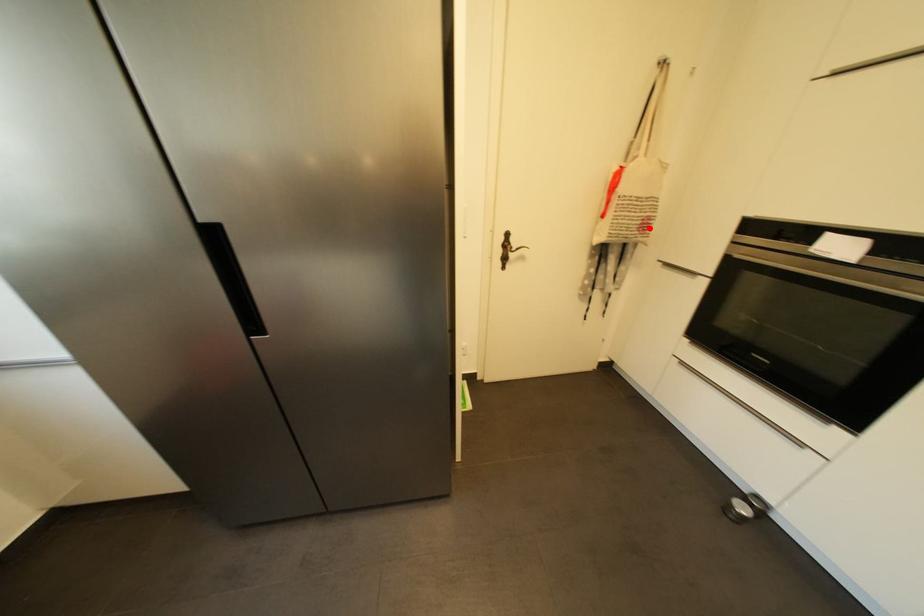
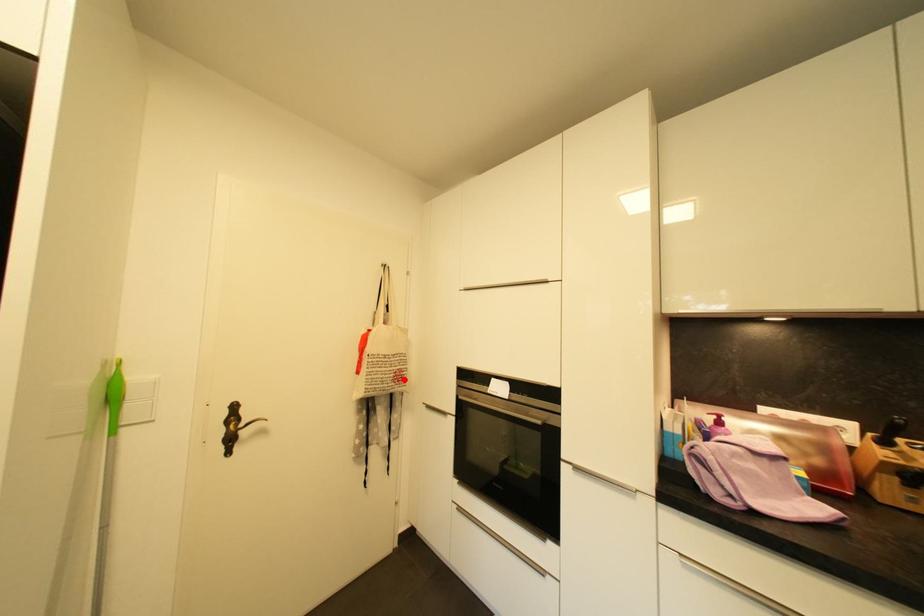
I am providing you with two images of the same scene from different viewpoints. A red point is marked on the first image and another point is marked on the second image. Does the point marked in image1 correspond to the same location as the one in image2?

Yes